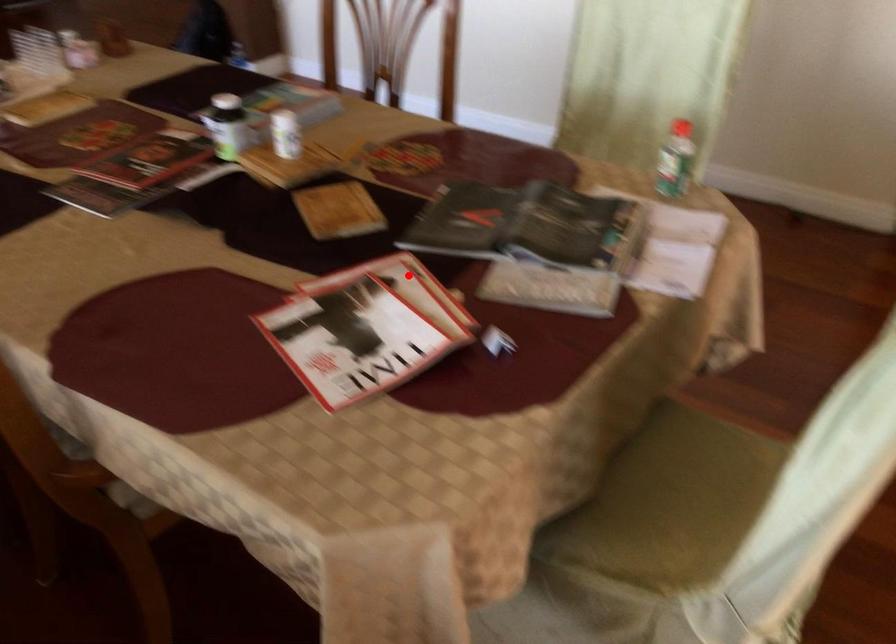
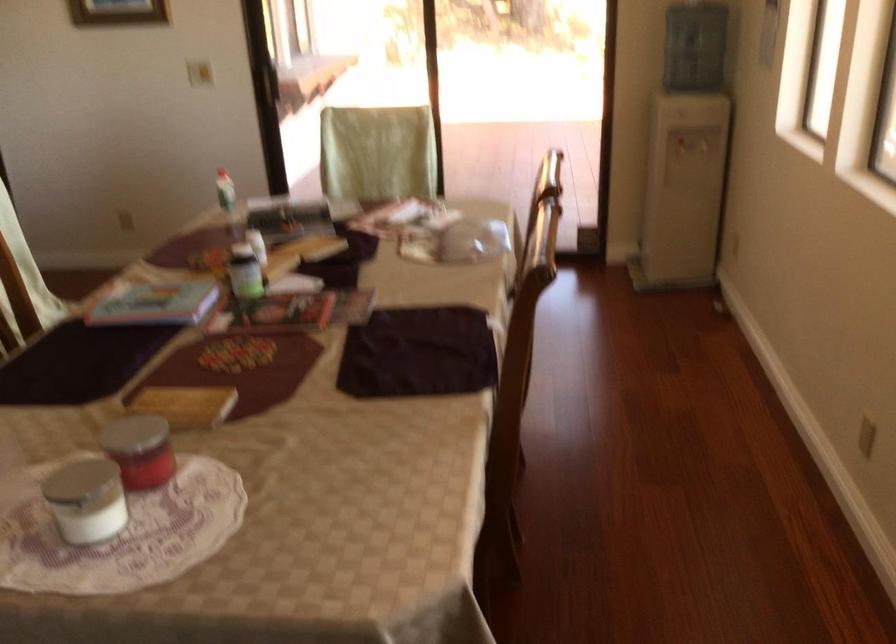
Question: I am providing you with two images of the same scene from different viewpoints. Image1 has a red point marked. In image2, the corresponding 3D location appears at what relative position? Reply with the corresponding letter.

Choices:
 (A) Closer
 (B) Farther

Answer: (B)